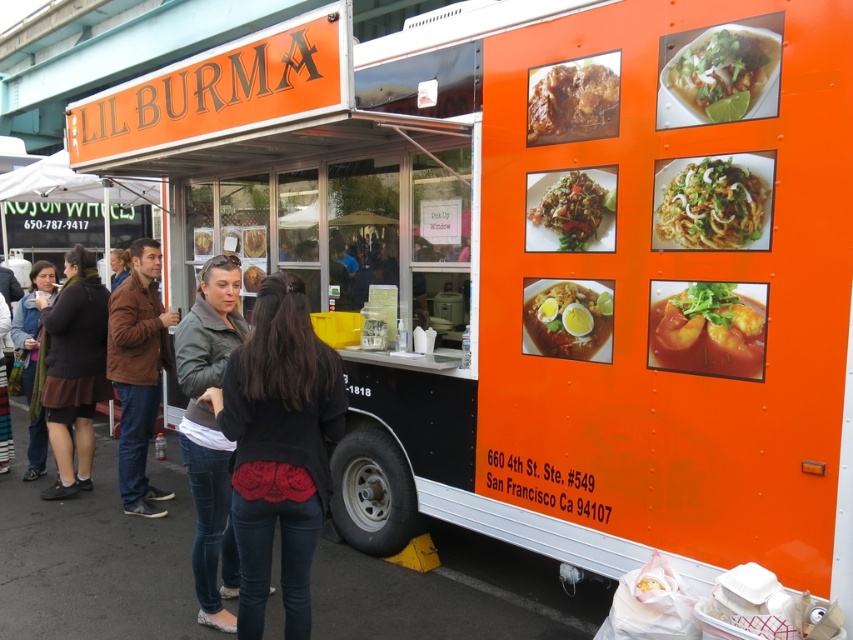
Question: Can you confirm if dark gray leather jacket at center is bigger than matte orange soup bowl at center?

Choices:
 (A) no
 (B) yes

Answer: (B)

Question: Which point is closer to the camera?

Choices:
 (A) (16, 323)
 (B) (262, 244)
 (C) (107, 308)
 (D) (718, 195)

Answer: (D)

Question: From the image, what is the correct spatial relationship of matte orange soup bowl at center in relation to matte black jacket at left?

Choices:
 (A) left
 (B) right

Answer: (B)

Question: Which point is farther to the camera?

Choices:
 (A) dark brown sweater at left
 (B) orange matte noodles at center

Answer: (A)

Question: Which of the following is the farthest from the observer?

Choices:
 (A) matte orange bowl at upper right
 (B) matte black jacket at left
 (C) matte orange bowl at center

Answer: (B)

Question: Does brown leather jacket at left have a greater width compared to shiny brown fried rice at center?

Choices:
 (A) no
 (B) yes

Answer: (B)